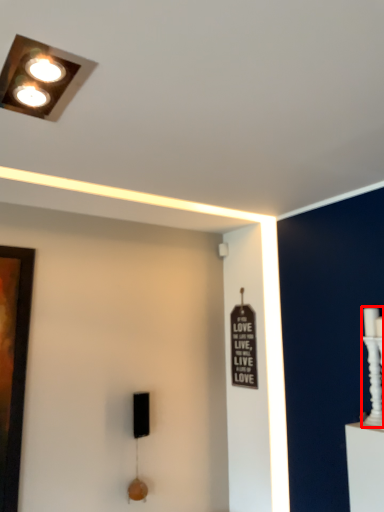
Question: Where is candle holder (annotated by the red box) located in relation to lamp in the image?

Choices:
 (A) right
 (B) left

Answer: (A)